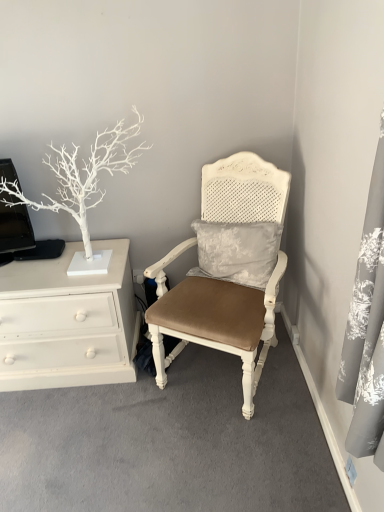
Identify the location of blank space to the left of matte white chair at center. (110, 415).